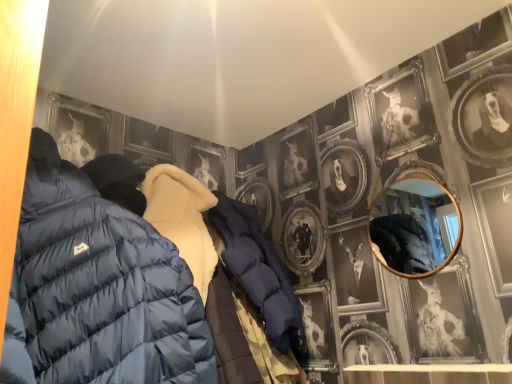
Question: Considering the positions of matte blue puffer jacket at left and gold-framed mirror at upper right in the image, is matte blue puffer jacket at left bigger or smaller than gold-framed mirror at upper right?

Choices:
 (A) small
 (B) big

Answer: (B)

Question: Is matte blue puffer jacket at left in front of or behind gold-framed mirror at upper right in the image?

Choices:
 (A) front
 (B) behind

Answer: (A)

Question: From the image's perspective, relative to gold-framed mirror at upper right, is matte blue puffer jacket at left above or below?

Choices:
 (A) below
 (B) above

Answer: (A)

Question: Is gold-framed mirror at upper right bigger or smaller than matte blue puffer jacket at left?

Choices:
 (A) small
 (B) big

Answer: (A)

Question: Considering the positions of gold-framed mirror at upper right and matte blue puffer jacket at left in the image, is gold-framed mirror at upper right wider or thinner than matte blue puffer jacket at left?

Choices:
 (A) wide
 (B) thin

Answer: (B)

Question: Considering the positions of gold-framed mirror at upper right and matte blue puffer jacket at left in the image, is gold-framed mirror at upper right taller or shorter than matte blue puffer jacket at left?

Choices:
 (A) tall
 (B) short

Answer: (B)

Question: Is gold-framed mirror at upper right in front of or behind matte blue puffer jacket at left in the image?

Choices:
 (A) behind
 (B) front

Answer: (A)